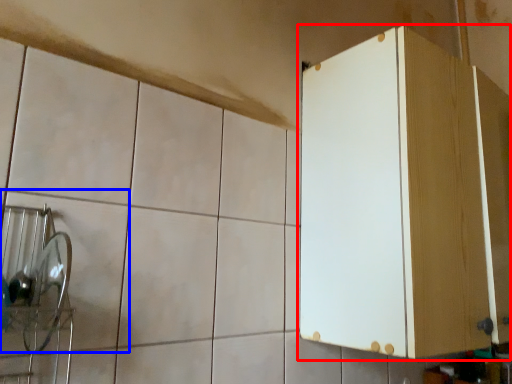
Question: Which object appears closest to the camera in this image, cabinetry (highlighted by a red box) or ceramic tile (highlighted by a blue box)?

Choices:
 (A) cabinetry
 (B) ceramic tile

Answer: (B)